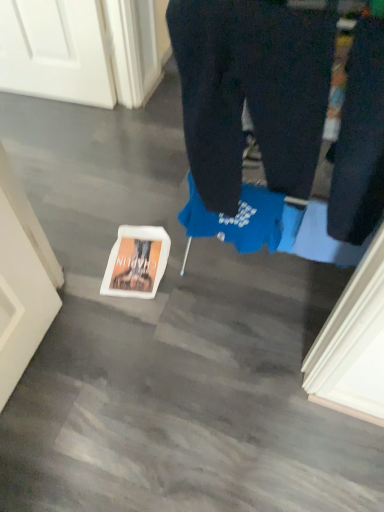
Question: Is dark blue cotton trousers at center at the right side of white matte book at lower center?

Choices:
 (A) no
 (B) yes

Answer: (B)

Question: Does dark blue cotton trousers at center have a lesser width compared to white matte book at lower center?

Choices:
 (A) no
 (B) yes

Answer: (B)

Question: Is dark blue cotton trousers at center in contact with white matte book at lower center?

Choices:
 (A) yes
 (B) no

Answer: (B)

Question: From a real-world perspective, is dark blue cotton trousers at center beneath white matte book at lower center?

Choices:
 (A) no
 (B) yes

Answer: (A)

Question: Is dark blue cotton trousers at center bigger than white matte book at lower center?

Choices:
 (A) no
 (B) yes

Answer: (B)

Question: Is white matte book at lower center bigger or smaller than dark blue cotton trousers at center?

Choices:
 (A) small
 (B) big

Answer: (A)

Question: From the image's perspective, is white matte book at lower center positioned above or below dark blue cotton trousers at center?

Choices:
 (A) below
 (B) above

Answer: (A)

Question: Which is correct: white matte book at lower center is inside dark blue cotton trousers at center, or outside of it?

Choices:
 (A) outside
 (B) inside

Answer: (A)

Question: Relative to dark blue cotton trousers at center, is white matte book at lower center in front or behind?

Choices:
 (A) behind
 (B) front

Answer: (A)

Question: From the image's perspective, relative to white matte book at lower center, is dark blue jeans at right above or below?

Choices:
 (A) above
 (B) below

Answer: (A)

Question: Considering the positions of dark blue jeans at right and white matte book at lower center in the image, is dark blue jeans at right taller or shorter than white matte book at lower center?

Choices:
 (A) short
 (B) tall

Answer: (B)

Question: Considering the positions of point (370, 20) and point (119, 289), is point (370, 20) closer or farther from the camera than point (119, 289)?

Choices:
 (A) closer
 (B) farther

Answer: (A)

Question: From a real-world perspective, is dark blue jeans at right above or below white matte book at lower center?

Choices:
 (A) below
 (B) above

Answer: (B)

Question: Based on their sizes in the image, would you say white matte book at lower center is bigger or smaller than dark blue jeans at right?

Choices:
 (A) small
 (B) big

Answer: (A)

Question: From the image's perspective, is white matte book at lower center above or below dark blue jeans at right?

Choices:
 (A) above
 (B) below

Answer: (B)